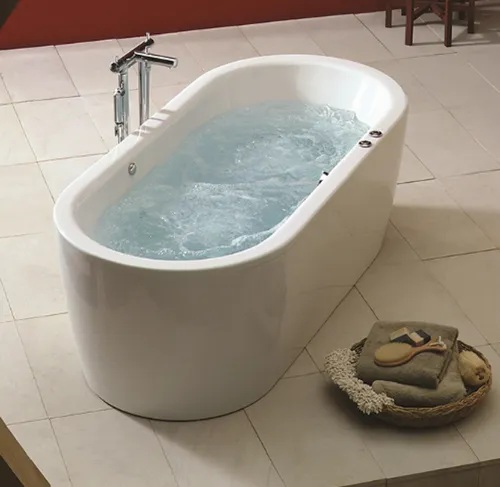
What are the coordinates of `white bath` in the screenshot? It's located at (201, 317).